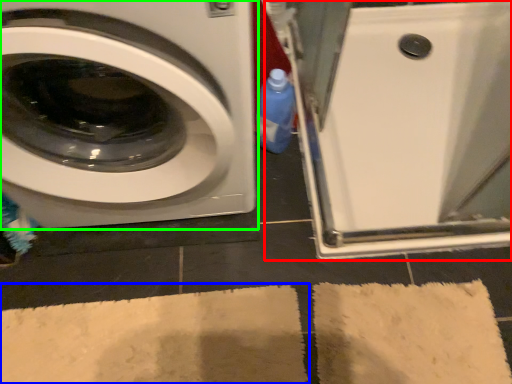
Question: Estimate the real-world distances between objects in this image. Which object is farther from machine (highlighted by a red box), bath mat (highlighted by a blue box) or washing machine (highlighted by a green box)?

Choices:
 (A) bath mat
 (B) washing machine

Answer: (A)